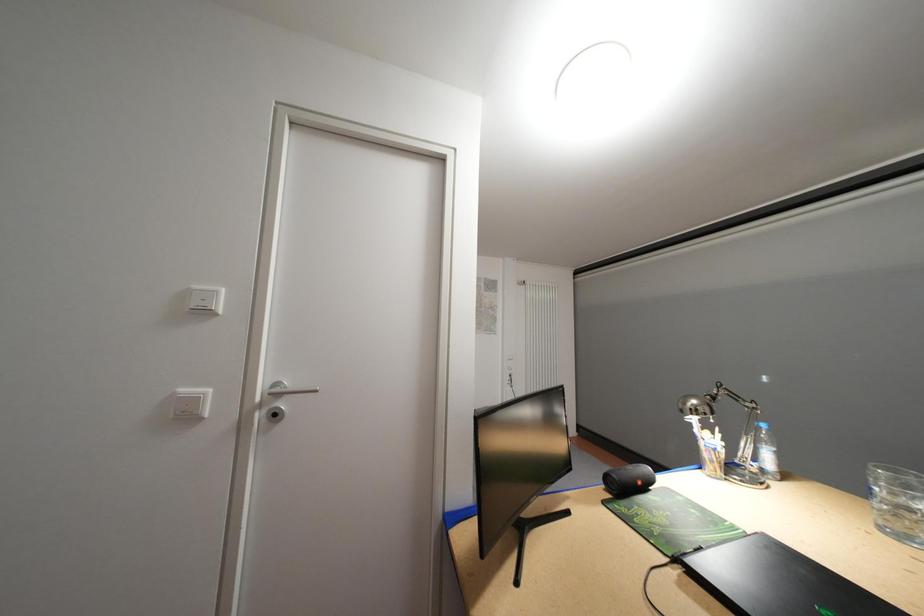
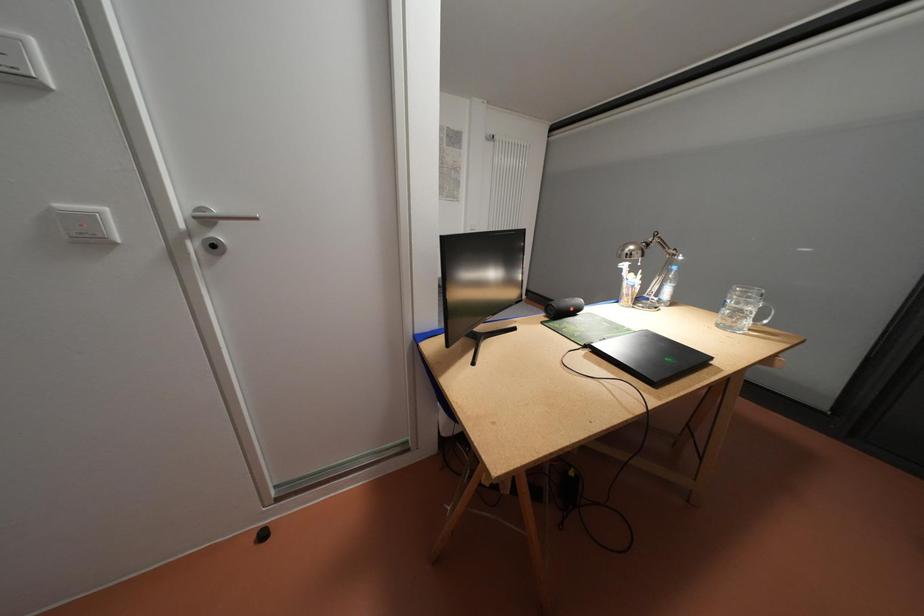
From the picture: Which direction would the cameraman need to move to produce the second image?

The movement direction of the cameraman is left, backward.